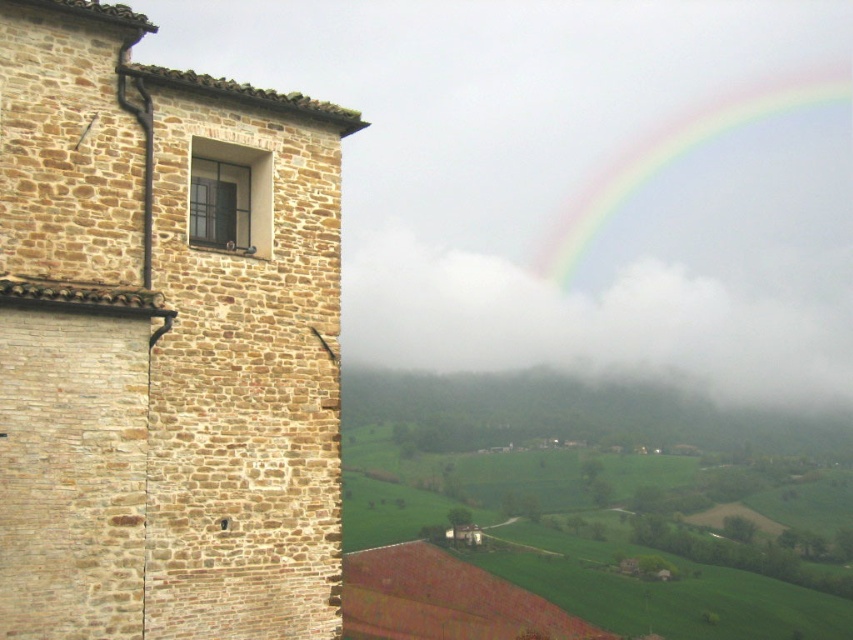
You are an architect designing a new building. You want to ensure that the white fluffy cloud at upper center and the matte glass window at upper left are visible from the main entrance. Given their positions, which object will appear larger in the view from the entrance?

The white fluffy cloud at upper center appears much taller than the matte glass window at upper left, so it will look larger in the view from the entrance.

Based on the photo, you are standing in the rural landscape scene and want to walk from the point at coordinates point (3,180) to the point at coordinates point (198,157). Which direction should you face to move towards the second point?

You should face towards the lower right direction to move from point (3,180) to point (198,157) since point (3,180) is in front of point (198,157).